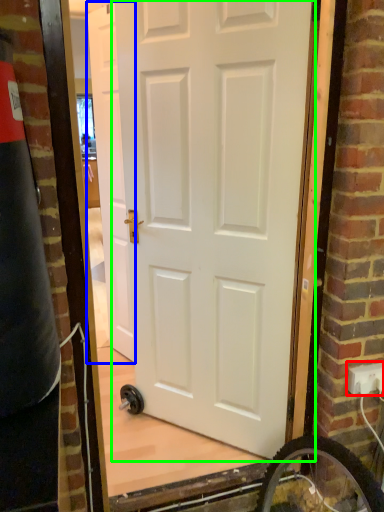
Question: Estimate the real-world distances between objects in this image. Which object is farther from electric outlet (highlighted by a red box), door (highlighted by a blue box) or door (highlighted by a green box)?

Choices:
 (A) door
 (B) door

Answer: (A)